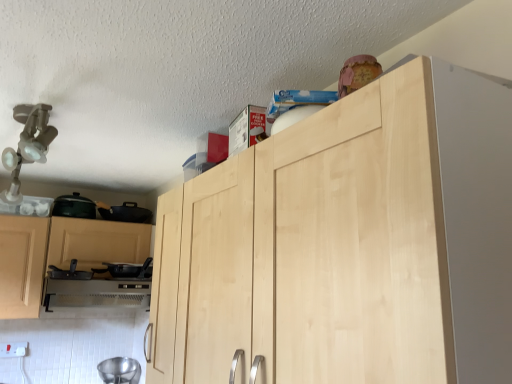
The image size is (512, 384). What do you see at coordinates (95, 296) in the screenshot?
I see `satin silver oven at lower left` at bounding box center [95, 296].

The height and width of the screenshot is (384, 512). What are the coordinates of `black matte pan at lower left, positioned as the 2th appliance in top-to-bottom order` in the screenshot? It's located at (69, 272).

This screenshot has height=384, width=512. Describe the element at coordinates (69, 272) in the screenshot. I see `black matte pan at lower left, the third appliance positioned from the bottom` at that location.

How much space does matte black pot at left, arranged as the 1th appliance when viewed from the top, occupy horizontally?

matte black pot at left, arranged as the 1th appliance when viewed from the top, is 11.90 inches wide.

The width and height of the screenshot is (512, 384). Describe the element at coordinates (74, 206) in the screenshot. I see `matte black pot at left, which is counted as the fourth appliance, starting from the bottom` at that location.

Locate an element on the screen. light wood/finish cabinet at left is located at coordinates pyautogui.click(x=58, y=254).

Relative to white plastic electric outlet at lower left, is matte black pot at left, arranged as the 1th appliance when viewed from the top, in front or behind?

matte black pot at left, arranged as the 1th appliance when viewed from the top, is behind white plastic electric outlet at lower left.

Is matte black pot at left, arranged as the 1th appliance when viewed from the top, facing away from white plastic electric outlet at lower left?

No.

From a real-world perspective, is matte black pot at left, arranged as the 1th appliance when viewed from the top, positioned under white plastic electric outlet at lower left based on gravity?

No, from a real-world perspective, matte black pot at left, arranged as the 1th appliance when viewed from the top, is not beneath white plastic electric outlet at lower left.

Can you confirm if matte black pot at left, arranged as the 1th appliance when viewed from the top, is smaller than white plastic electric outlet at lower left?

No, matte black pot at left, arranged as the 1th appliance when viewed from the top, is not smaller than white plastic electric outlet at lower left.

Is black matte pan at lower left, the third appliance positioned from the bottom, closer to camera compared to black matte pan at lower left, the second appliance from the bottom?

Yes, black matte pan at lower left, the third appliance positioned from the bottom, is closer to the viewer.

Can you confirm if black matte pan at lower left, positioned as the 2th appliance in top-to-bottom order, is shorter than black matte pan at lower left, the second appliance from the bottom?

Yes.

From their relative heights in the image, would you say satin silver oven at lower left is taller or shorter than white plastic electric outlet at lower left?

Considering their sizes, satin silver oven at lower left has more height than white plastic electric outlet at lower left.

Is satin silver oven at lower left oriented away from white plastic electric outlet at lower left?

That's not correct — satin silver oven at lower left is not looking away from white plastic electric outlet at lower left.

Which object is positioned more to the right, satin silver oven at lower left or white plastic electric outlet at lower left?

satin silver oven at lower left.

Who is taller, black matte pan at lower left, positioned as the 2th appliance in top-to-bottom order, or satin silver oven at lower left?

With more height is satin silver oven at lower left.

Does point (83, 273) appear closer or farther from the camera than point (51, 302)?

Point (83, 273) is positioned farther from the camera compared to point (51, 302).

From a real-world perspective, does black matte pan at lower left, the third appliance positioned from the bottom, stand above satin silver oven at lower left?

Yes, from a real-world perspective, black matte pan at lower left, the third appliance positioned from the bottom, is above satin silver oven at lower left.

Who is more distant, black matte pan at lower left, the third appliance positioned from the bottom, or satin silver oven at lower left?

satin silver oven at lower left.

How many degrees apart are the facing directions of black matte pan at lower left, the third appliance positioned from the bottom, and matte black pot at left, which is counted as the fourth appliance, starting from the bottom?

black matte pan at lower left, the third appliance positioned from the bottom, and matte black pot at left, which is counted as the fourth appliance, starting from the bottom, are facing 22.4 degrees away from each other.

Which point is more distant from viewer, (61, 274) or (64, 198)?

The point (64, 198) is behind.

Is black matte pan at lower left, the third appliance positioned from the bottom, far from matte black pot at left, which is counted as the fourth appliance, starting from the bottom?

No, black matte pan at lower left, the third appliance positioned from the bottom, is in close proximity to matte black pot at left, which is counted as the fourth appliance, starting from the bottom.

From the image's perspective, which one is positioned lower, black matte pan at lower left, the third appliance positioned from the bottom, or matte black pot at left, arranged as the 1th appliance when viewed from the top?

black matte pan at lower left, the third appliance positioned from the bottom, appears lower in the image.

From the image's perspective, which is below, light wood/finish cabinet at left or matte black pot at left, arranged as the 1th appliance when viewed from the top?

From the image's view, light wood/finish cabinet at left is below.

Based on the photo, does light wood/finish cabinet at left turn towards matte black pot at left, which is counted as the fourth appliance, starting from the bottom?

No, light wood/finish cabinet at left is not turned towards matte black pot at left, which is counted as the fourth appliance, starting from the bottom.

Between point (16, 244) and point (81, 205), which one is positioned behind?

The point (81, 205) is farther.

Considering the positions of objects light wood/finish cabinet at left and matte black pot at left, which is counted as the fourth appliance, starting from the bottom, in the image provided, who is behind, light wood/finish cabinet at left or matte black pot at left, which is counted as the fourth appliance, starting from the bottom,?

matte black pot at left, which is counted as the fourth appliance, starting from the bottom, is more distant.

Does satin silver oven at lower left have a larger size compared to light wood/finish cabinet at left?

Incorrect, satin silver oven at lower left is not larger than light wood/finish cabinet at left.

From a real-world perspective, between satin silver oven at lower left and light wood/finish cabinet at left, who is vertically lower?

satin silver oven at lower left is physically lower.

Is satin silver oven at lower left not inside light wood/finish cabinet at left?

No, most part of satin silver oven at lower left lies within light wood/finish cabinet at left.

Locate an element on the screen. This screenshot has height=384, width=512. cabinetry on the left of satin silver oven at lower left is located at coordinates (58, 254).

Identify the location of electric outlet that appears below the matte black pot at left, arranged as the 1th appliance when viewed from the top (from a real-world perspective). The width and height of the screenshot is (512, 384). (14, 349).

At what (x,y) coordinates should I click in order to perform the action: click on the 1st appliance below the black matte pan at lower left, the third appliance positioned from the bottom (from the image's perspective). Please return your answer as a coordinate pair (x, y). The width and height of the screenshot is (512, 384). Looking at the image, I should click on (130, 269).

Looking at this image, considering their positions, is white plastic electric outlet at lower left positioned closer to natural wood cabinet at upper center than satin silver oven at lower left?

satin silver oven at lower left lies closer to natural wood cabinet at upper center than the other object.

When comparing their distances from matte black pot at left, arranged as the 1th appliance when viewed from the top, does white plastic electric outlet at lower left or black matte pan at lower left, the third appliance positioned from the bottom, seem closer?

Among the two, black matte pan at lower left, the third appliance positioned from the bottom, is located nearer to matte black pot at left, arranged as the 1th appliance when viewed from the top.

Which object lies further to the anchor point satin silver oven at lower left, white plastic electric outlet at lower left or light wood/finish cabinet at left?

Among the two, white plastic electric outlet at lower left is located further to satin silver oven at lower left.

Which object lies further to the anchor point metallic silver bowl at lower left, which appears as the fourth appliance when viewed from the top, black matte pan at lower left, the third appliance from the top, or satin silver oven at lower left?

The object further to metallic silver bowl at lower left, which appears as the fourth appliance when viewed from the top, is black matte pan at lower left, the third appliance from the top.

From the image, which object appears to be farther from white plastic electric outlet at lower left, natural wood cabinet at upper center or black matte pan at lower left, the second appliance from the bottom?

natural wood cabinet at upper center is positioned further to the anchor white plastic electric outlet at lower left.

Based on their spatial positions, is satin silver oven at lower left or metallic silver bowl at lower left, which appears as the 1th appliance when ordered from the bottom, closer to black matte pan at lower left, the third appliance positioned from the bottom?

Among the two, satin silver oven at lower left is located nearer to black matte pan at lower left, the third appliance positioned from the bottom.

When comparing their distances from metallic silver bowl at lower left, which appears as the 1th appliance when ordered from the bottom, does white plastic electric outlet at lower left or light wood/finish cabinet at left seem closer?

white plastic electric outlet at lower left.

Looking at the image, which one is located further to white plastic electric outlet at lower left, light wood/finish cabinet at left or natural wood cabinet at upper center?

Among the two, natural wood cabinet at upper center is located further to white plastic electric outlet at lower left.

This screenshot has height=384, width=512. What are the coordinates of `oven positioned between natural wood cabinet at upper center and metallic silver bowl at lower left, which appears as the 1th appliance when ordered from the bottom, from near to far` in the screenshot? It's located at (95, 296).

The image size is (512, 384). I want to click on cabinetry between white plastic electric outlet at lower left and black matte pan at lower left, the second appliance from the bottom, so click(58, 254).

You are a GUI agent. You are given a task and a screenshot of the screen. Output one action in this format:
    pyautogui.click(x=<x>, y=<y>)
    Task: Click on the oven situated between black matte pan at lower left, positioned as the 2th appliance in top-to-bottom order, and black matte pan at lower left, the second appliance from the bottom, from left to right
    
    Given the screenshot: What is the action you would take?
    pyautogui.click(x=95, y=296)

Where is `cabinetry between matte black pot at left, arranged as the 1th appliance when viewed from the top, and satin silver oven at lower left in the up-down direction`? Image resolution: width=512 pixels, height=384 pixels. cabinetry between matte black pot at left, arranged as the 1th appliance when viewed from the top, and satin silver oven at lower left in the up-down direction is located at coordinates (58, 254).